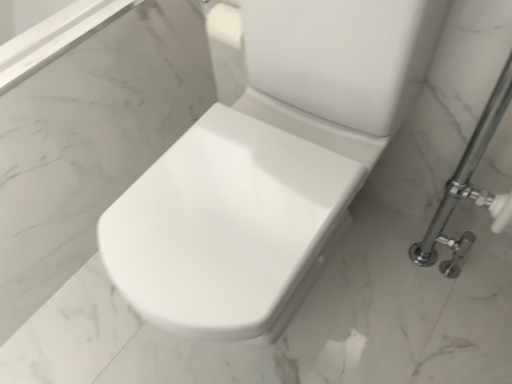
Locate an element on the screen. The height and width of the screenshot is (384, 512). vacant space underneath chrome/metallic shower at right (from a real-world perspective) is located at coordinates (459, 283).